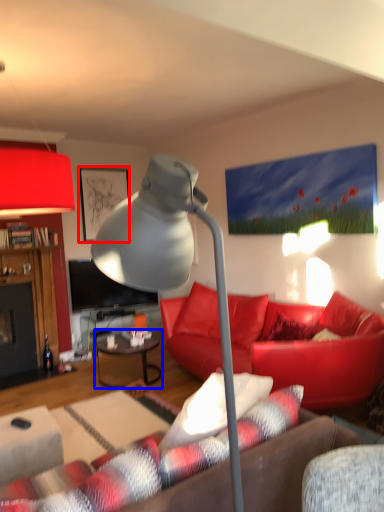
Question: Which object appears farthest to the camera in this image, picture frame (highlighted by a red box) or table (highlighted by a blue box)?

Choices:
 (A) picture frame
 (B) table

Answer: (A)